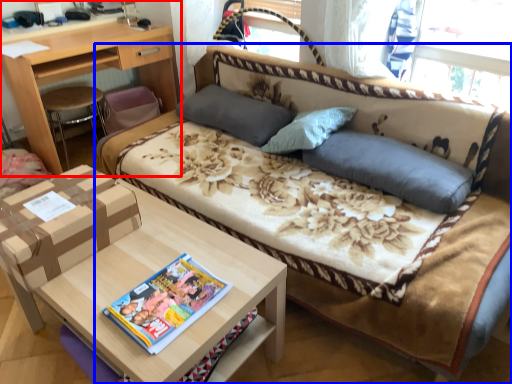
Question: Among these objects, which one is nearest to the camera, desk (highlighted by a red box) or studio couch (highlighted by a blue box)?

Choices:
 (A) desk
 (B) studio couch

Answer: (B)